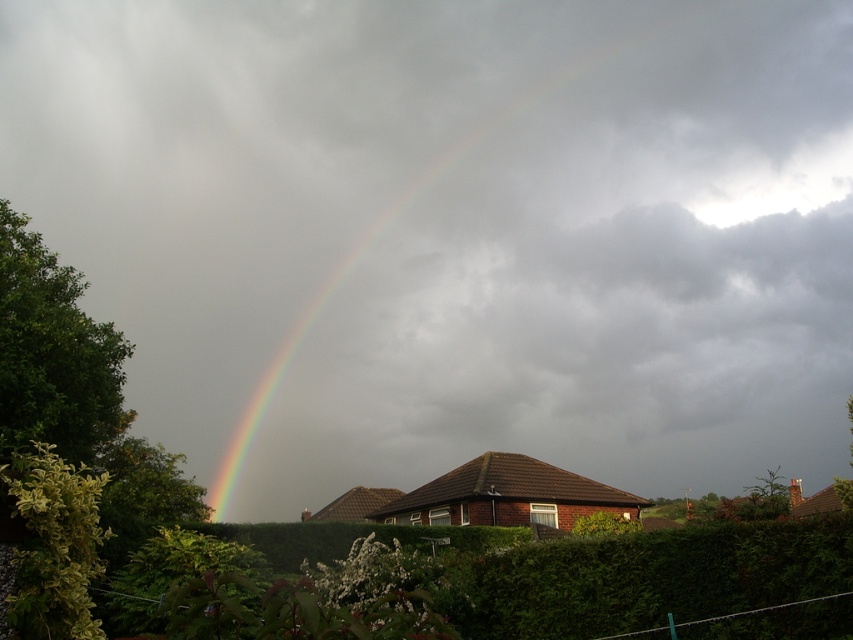
Question: Is rainbow at upper center wider than green leafy hedge at lower center?

Choices:
 (A) yes
 (B) no

Answer: (A)

Question: Considering the relative positions of green leafy hedge at lower center and green leafy hedge at left in the image provided, where is green leafy hedge at lower center located with respect to green leafy hedge at left?

Choices:
 (A) right
 (B) left

Answer: (A)

Question: Which point appears closest to the camera in this image?

Choices:
 (A) (91, 436)
 (B) (582, 586)
 (C) (73, 132)

Answer: (B)

Question: Which point appears farthest from the camera in this image?

Choices:
 (A) (39, 285)
 (B) (370, 42)

Answer: (B)

Question: Which point is closer to the camera taking this photo?

Choices:
 (A) (48, 541)
 (B) (21, 368)

Answer: (A)

Question: Is rainbow at upper center above green leafy hedge at lower left?

Choices:
 (A) no
 (B) yes

Answer: (B)